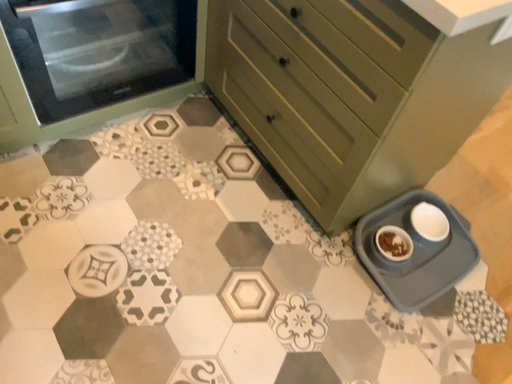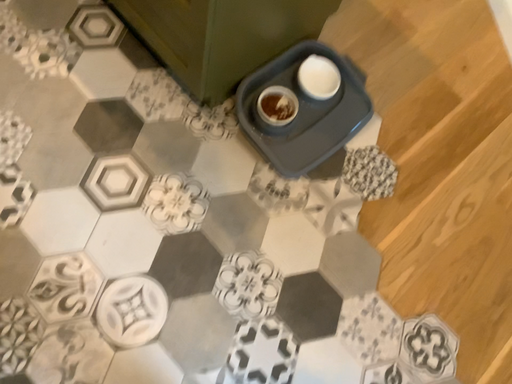
Question: How did the camera likely rotate when shooting the video?

Choices:
 (A) rotated right
 (B) rotated left

Answer: (A)